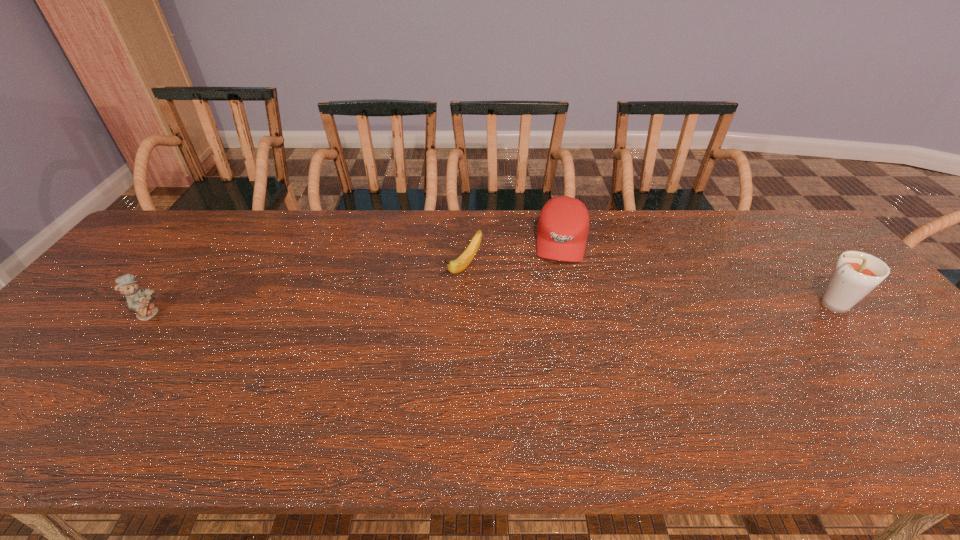
In the image, there is a desktop. Where is `vacant area at the near edge`? This screenshot has width=960, height=540. vacant area at the near edge is located at coordinates (574, 378).

The width and height of the screenshot is (960, 540). I want to click on vacant space at the right edge of the desktop, so click(810, 270).

This screenshot has width=960, height=540. In the image, there is a desktop. Identify the location of free space at the far right corner. (772, 244).

I want to click on vacant space at the near right corner of the desktop, so click(x=946, y=387).

Locate an element on the screen. The image size is (960, 540). free space between the shortest object and the tallest object is located at coordinates (647, 286).

Find the location of a particular element. The height and width of the screenshot is (540, 960). free point between the tallest object and the cap is located at coordinates (695, 273).

Identify the location of unoccupied position between the leftmost object and the shortest object. Image resolution: width=960 pixels, height=540 pixels. (307, 289).

Image resolution: width=960 pixels, height=540 pixels. I want to click on vacant area that lies between the tallest object and the leftmost object, so click(489, 309).

Where is `vacant area that lies between the cap and the shortest object`? Image resolution: width=960 pixels, height=540 pixels. vacant area that lies between the cap and the shortest object is located at coordinates (514, 254).

Identify the location of blank region between the shortest object and the cap. (514, 254).